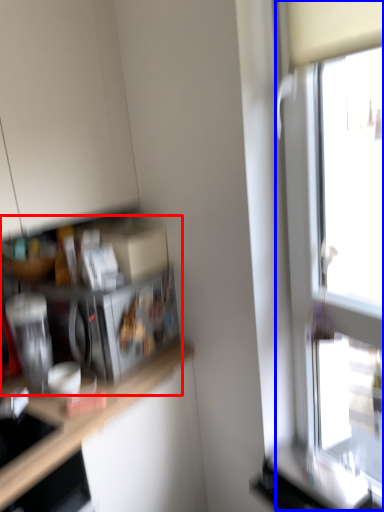
Question: Which object appears farthest to the camera in this image, shelf (highlighted by a red box) or window (highlighted by a blue box)?

Choices:
 (A) shelf
 (B) window

Answer: (A)